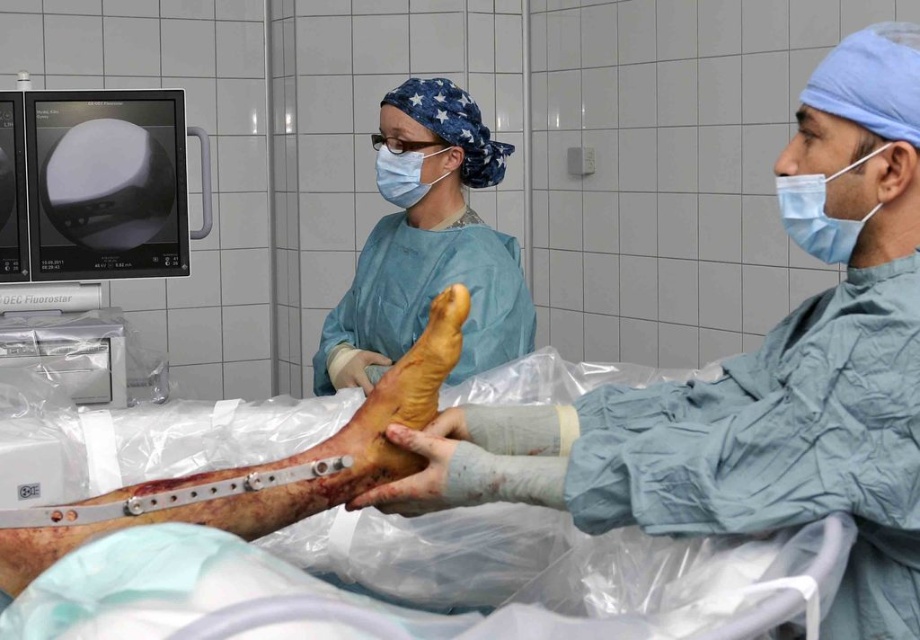
Who is positioned more to the left, metallic/plastic bone at center or blue matte mask at upper center?

metallic/plastic bone at center is more to the left.

The image size is (920, 640). What are the coordinates of `metallic/plastic bone at center` in the screenshot? It's located at (x=259, y=468).

Is blue surgical gown at center bigger than metallic/plastic bone at center?

Yes, blue surgical gown at center is bigger than metallic/plastic bone at center.

Does point (364, 246) come in front of point (256, 518)?

No, it is behind (256, 518).

Is point (370, 269) farther from camera compared to point (369, 474)?

Yes, point (370, 269) is behind point (369, 474).

Image resolution: width=920 pixels, height=640 pixels. I want to click on blue surgical gown at center, so click(x=428, y=244).

In order to click on metallic/plastic bone at center in this screenshot , I will do `click(259, 468)`.

Which of these two, metallic/plastic bone at center or blue surgical mask at right, stands taller?

Standing taller between the two is metallic/plastic bone at center.

Measure the distance between point (391, 388) and camera.

95.34 centimeters

Where is `metallic/plastic bone at center`? metallic/plastic bone at center is located at coordinates (259, 468).